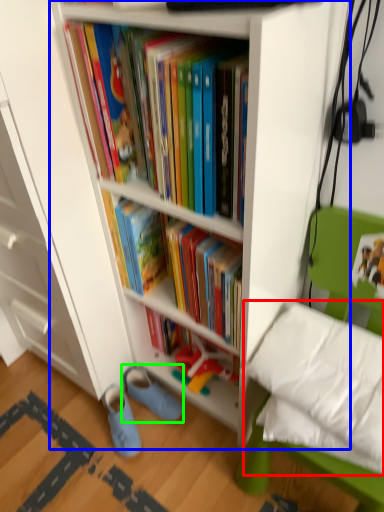
Question: Which is nearer to the pillow (highlighted by a red box)? bookcase (highlighted by a blue box) or footwear (highlighted by a green box).

Choices:
 (A) bookcase
 (B) footwear

Answer: (A)